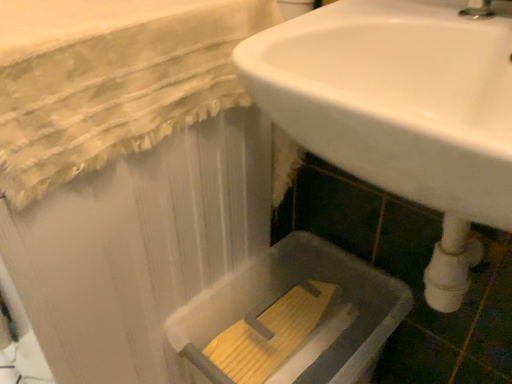
Question: From the image's perspective, is translucent plastic bath at lower right over white glossy sink at center?

Choices:
 (A) yes
 (B) no

Answer: (B)

Question: From a real-world perspective, is translucent plastic bath at lower right positioned over white glossy sink at center based on gravity?

Choices:
 (A) no
 (B) yes

Answer: (A)

Question: Is the depth of translucent plastic bath at lower right greater than that of white glossy sink at center?

Choices:
 (A) yes
 (B) no

Answer: (A)

Question: Is translucent plastic bath at lower right positioned beyond the bounds of white glossy sink at center?

Choices:
 (A) no
 (B) yes

Answer: (B)

Question: From a real-world perspective, is translucent plastic bath at lower right physically below white glossy sink at center?

Choices:
 (A) yes
 (B) no

Answer: (A)

Question: Can you confirm if translucent plastic bath at lower right is shorter than white glossy sink at center?

Choices:
 (A) yes
 (B) no

Answer: (B)

Question: Does white glossy sink at center come behind translucent plastic bath at lower right?

Choices:
 (A) no
 (B) yes

Answer: (A)

Question: Considering the relative sizes of white glossy sink at center and translucent plastic bath at lower right in the image provided, is white glossy sink at center bigger than translucent plastic bath at lower right?

Choices:
 (A) no
 (B) yes

Answer: (B)

Question: Considering the relative sizes of white glossy sink at center and translucent plastic bath at lower right in the image provided, is white glossy sink at center taller than translucent plastic bath at lower right?

Choices:
 (A) yes
 (B) no

Answer: (B)

Question: Does white glossy sink at center turn towards translucent plastic bath at lower right?

Choices:
 (A) yes
 (B) no

Answer: (B)

Question: From the image's perspective, is white glossy sink at center located beneath translucent plastic bath at lower right?

Choices:
 (A) no
 (B) yes

Answer: (A)

Question: Does white glossy sink at center come in front of translucent plastic bath at lower right?

Choices:
 (A) no
 (B) yes

Answer: (B)

Question: From a real-world perspective, relative to white glossy sink at center, is translucent plastic bath at lower right vertically above or below?

Choices:
 (A) below
 (B) above

Answer: (A)